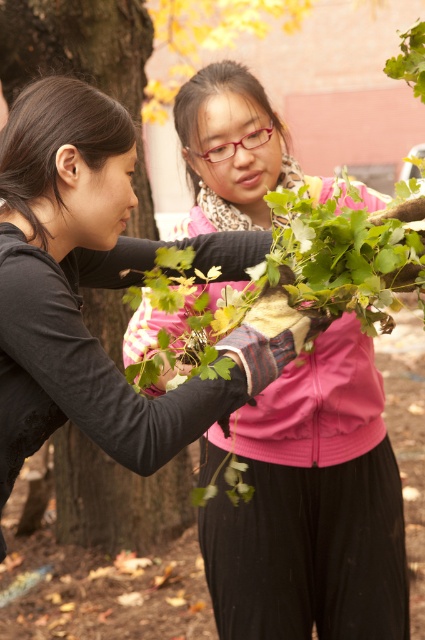
Does pink fabric at center appear on the left side of brown rough tree trunk at left?

In fact, pink fabric at center is to the right of brown rough tree trunk at left.

Can you confirm if pink fabric at center is positioned above brown rough tree trunk at left?

No, pink fabric at center is not above brown rough tree trunk at left.

The height and width of the screenshot is (640, 425). What do you see at coordinates (312, 506) in the screenshot?
I see `pink fabric at center` at bounding box center [312, 506].

Locate an element on the screen. pink fabric at center is located at coordinates (312, 506).